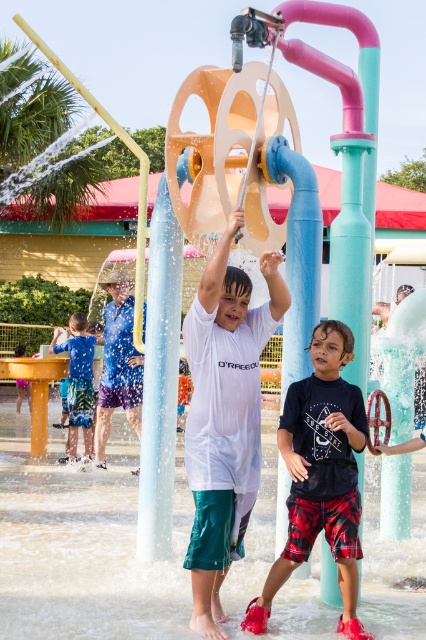
Question: Which point is closer to the camera?

Choices:
 (A) matte white shirt at center
 (B) white matte shirt at center
 (C) blue cotton shirt at center

Answer: (B)

Question: Which point appears closest to the camera in this image?

Choices:
 (A) (80, 380)
 (B) (106, 412)
 (C) (48, 636)
 (D) (241, 500)

Answer: (C)

Question: Does blue printed shorts at lower left come behind matte white shirt at center?

Choices:
 (A) no
 (B) yes

Answer: (A)

Question: Can you confirm if black cotton t-shirt at center is positioned above matte white shirt at center?

Choices:
 (A) yes
 (B) no

Answer: (A)

Question: From the image, what is the correct spatial relationship of blue cotton shirt at center in relation to matte white shirt at center?

Choices:
 (A) left
 (B) right

Answer: (B)

Question: Which point appears closest to the camera in this image?

Choices:
 (A) (74, 433)
 (B) (135, 422)
 (C) (19, 392)
 (D) (333, 518)

Answer: (D)